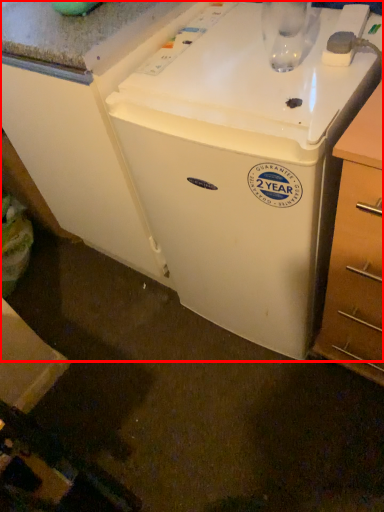
Question: Where is home appliance (annotated by the red box) located in relation to drawer in the image?

Choices:
 (A) right
 (B) left

Answer: (B)